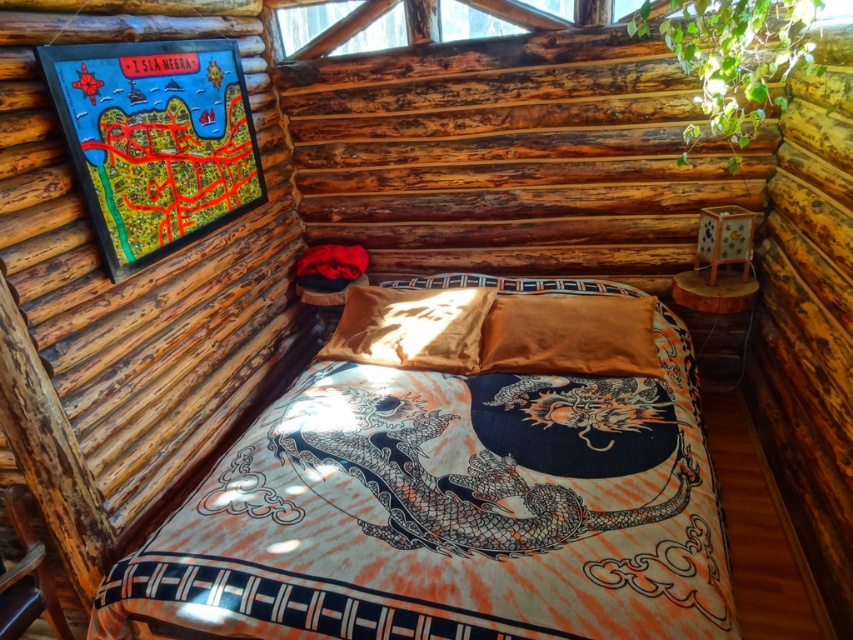
You are taking a photo of the rustic bedroom and want to focus on both point (294, 499) and point (639, 316). Which point should you adjust your focus to first to ensure it is in the foreground?

Point (294, 499) is closer to the camera than point (639, 316), so you should adjust your focus to point (294, 499) first to ensure it is in the foreground.

In the scene shown: You are a delivery person who needs to place a small package between the silky cotton bed at center and the satin gold pillow at center. The package measures 18 inches in length. Can you fit it in the space between them?

The distance between the silky cotton bed at center and the satin gold pillow at center is 16.66 inches. Since the package is 18 inches long, it cannot fit in the available space.

You are standing at the entrance of the rustic bedroom and want to walk directly to the silky cotton bed at center. Based on your position, which direction should you head towards?

The silky cotton bed at center is located at point coordinates, so you should head towards the center of the room to reach it.